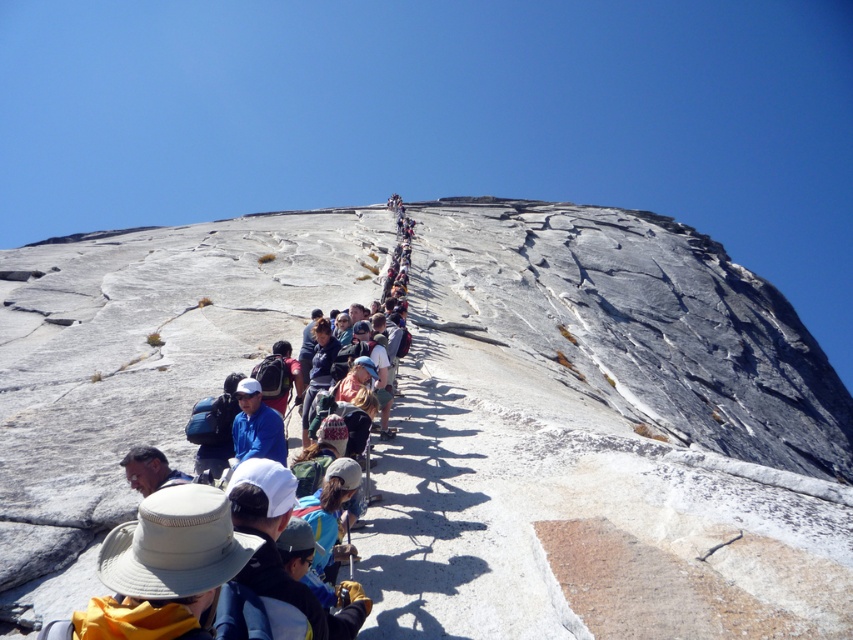
Can you confirm if gray rock formation at center is positioned above light brown leather hat at center?

Incorrect, gray rock formation at center is not positioned above light brown leather hat at center.

Is point (704, 392) positioned after point (277, 324)?

That is True.

Is point (386, 442) positioned behind point (57, 428)?

Yes.

At what (x,y) coordinates should I click in order to perform the action: click on gray rock formation at center. Please return your answer as a coordinate pair (x, y). The image size is (853, 640). Looking at the image, I should click on 602,429.